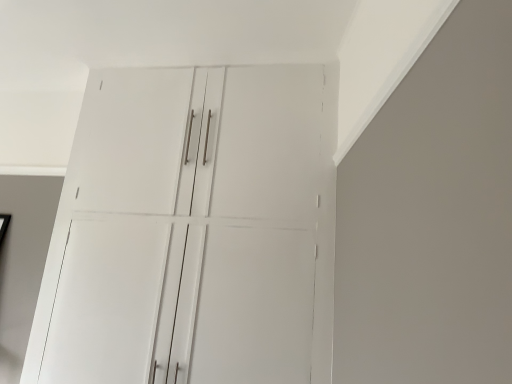
Question: Should I look upward or downward to see white glossy cabinet at upper center?

Choices:
 (A) up
 (B) down

Answer: (B)